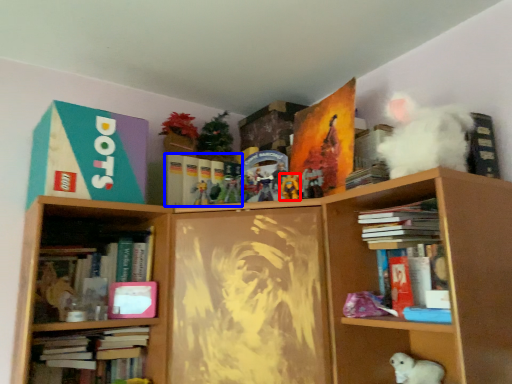
Question: Which object is further to the camera taking this photo, toy (highlighted by a red box) or book (highlighted by a blue box)?

Choices:
 (A) toy
 (B) book

Answer: (B)